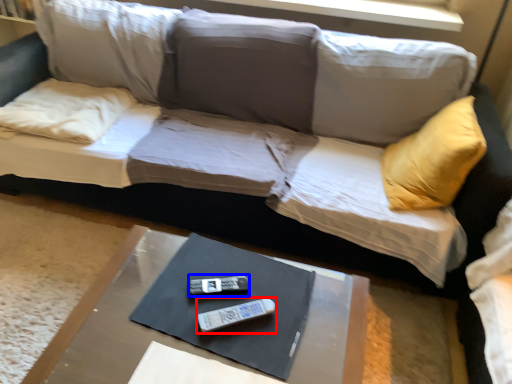
Question: Among these objects, which one is nearest to the camera, remote (highlighted by a red box) or remote (highlighted by a blue box)?

Choices:
 (A) remote
 (B) remote

Answer: (A)